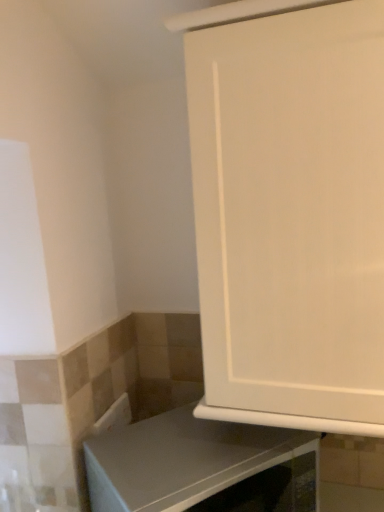
Question: Is gray matte countertop at lower center bigger or smaller than white matte cabinet at center?

Choices:
 (A) big
 (B) small

Answer: (B)

Question: In terms of width, does gray matte countertop at lower center look wider or thinner when compared to white matte cabinet at center?

Choices:
 (A) thin
 (B) wide

Answer: (A)

Question: From a real-world perspective, relative to white matte cabinet at center, is gray matte countertop at lower center vertically above or below?

Choices:
 (A) below
 (B) above

Answer: (A)

Question: From the image's perspective, is white matte cabinet at center above or below gray matte countertop at lower center?

Choices:
 (A) below
 (B) above

Answer: (B)

Question: Is white matte cabinet at center to the left or to the right of gray matte countertop at lower center in the image?

Choices:
 (A) left
 (B) right

Answer: (B)

Question: Would you say white matte cabinet at center is inside or outside gray matte countertop at lower center?

Choices:
 (A) inside
 (B) outside

Answer: (B)

Question: Looking at the image, does white matte cabinet at center seem bigger or smaller compared to gray matte countertop at lower center?

Choices:
 (A) small
 (B) big

Answer: (B)